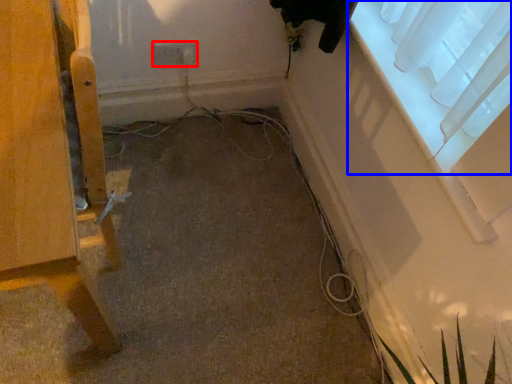
Question: Which point is closer to the camera, electric outlet (highlighted by a red box) or window (highlighted by a blue box)?

Choices:
 (A) electric outlet
 (B) window

Answer: (B)